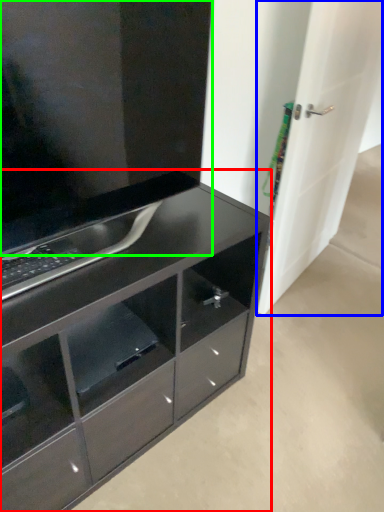
Question: Considering the real-world distances, which object is farthest from chest of drawers (highlighted by a red box)? door (highlighted by a blue box) or cabinetry (highlighted by a green box)?

Choices:
 (A) door
 (B) cabinetry

Answer: (A)